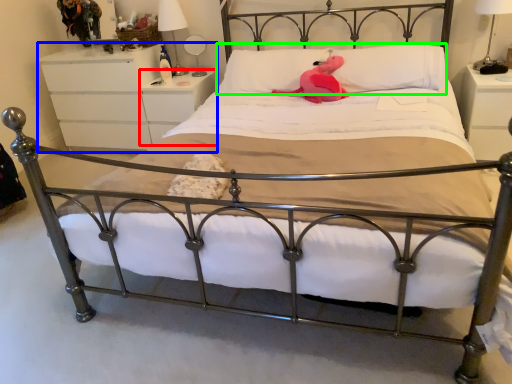
Question: Considering the real-world distances, which object is farthest from nightstand (highlighted by a red box)? nightstand (highlighted by a blue box) or pillow (highlighted by a green box)?

Choices:
 (A) nightstand
 (B) pillow

Answer: (B)